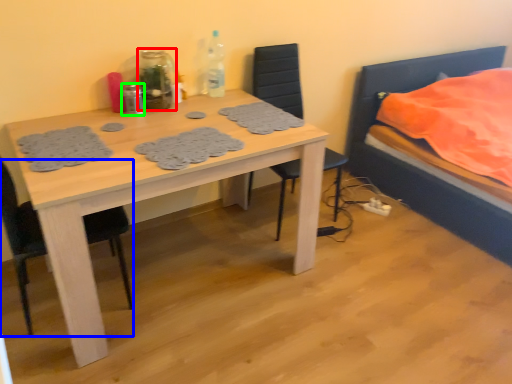
Question: Which is nearer to the bottle (highlighted by a red box)? chair (highlighted by a blue box) or bottle (highlighted by a green box).

Choices:
 (A) chair
 (B) bottle

Answer: (B)